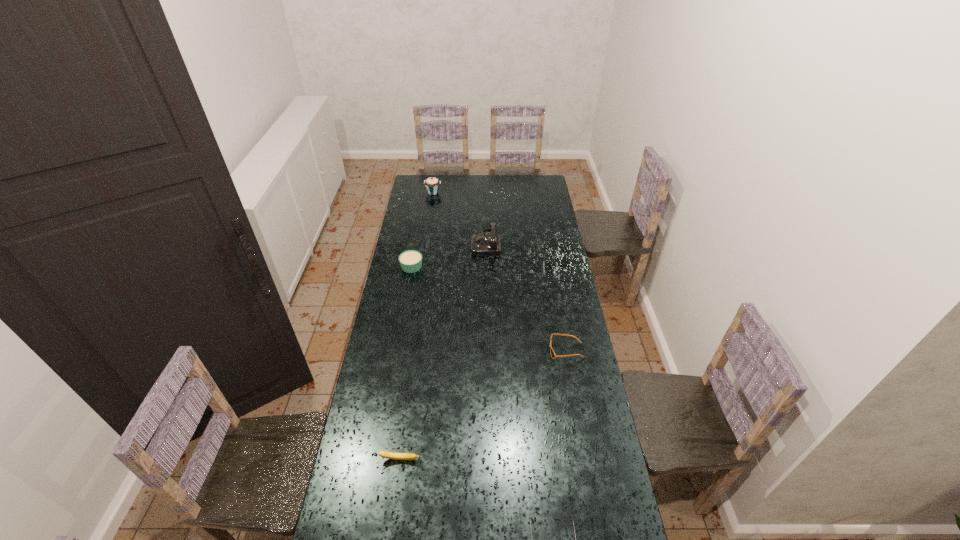
In order to click on the fourth object from left to right in this screenshot , I will do `click(482, 244)`.

Where is `the second farthest object`? The image size is (960, 540). the second farthest object is located at coordinates (482, 244).

Identify the location of the taller cupcake. (x=432, y=184).

I want to click on the farther cupcake, so click(432, 184).

Identify the location of the shorter cupcake. (411, 261).

This screenshot has height=540, width=960. Identify the location of the third tallest object. (411, 261).

Identify the location of banana. (389, 455).

Where is `the third nearest object`? This screenshot has height=540, width=960. the third nearest object is located at coordinates (553, 355).

Locate an element on the screen. The width and height of the screenshot is (960, 540). the rightmost object is located at coordinates (553, 355).

In order to click on vacant space located on the dial of the third object from right to left in this screenshot , I will do `click(438, 243)`.